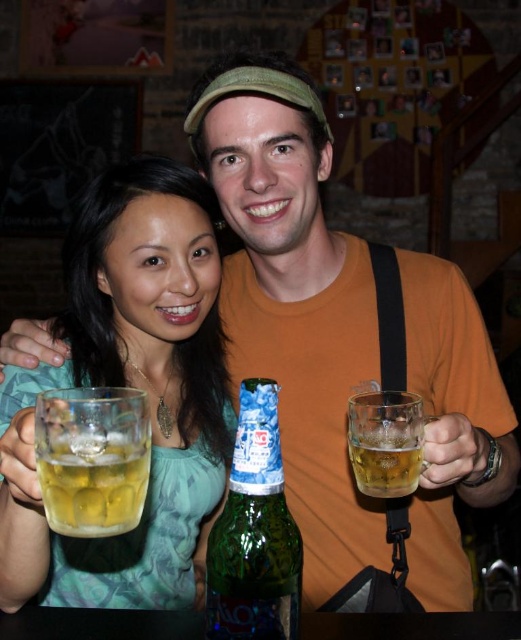
Question: Can you confirm if green glass bottle at center is positioned to the left of translucent glass mug at lower left?

Choices:
 (A) no
 (B) yes

Answer: (A)

Question: Does translucent glass mug at upper left have a lesser width compared to green glass bottle at center?

Choices:
 (A) no
 (B) yes

Answer: (A)

Question: Which point is closer to the camera?

Choices:
 (A) (115, 532)
 (B) (220, 608)
 (C) (100, 310)

Answer: (A)

Question: Which point is farther to the camera?

Choices:
 (A) translucent glass mug at right
 (B) translucent glass mug at lower left

Answer: (A)

Question: Which is nearer to the translucent glass mug at right?

Choices:
 (A) green glass bottle at center
 (B) translucent glass mug at lower left

Answer: (A)

Question: Considering the relative positions of translucent glass mug at upper left and translucent glass mug at lower left in the image provided, where is translucent glass mug at upper left located with respect to translucent glass mug at lower left?

Choices:
 (A) below
 (B) above

Answer: (A)